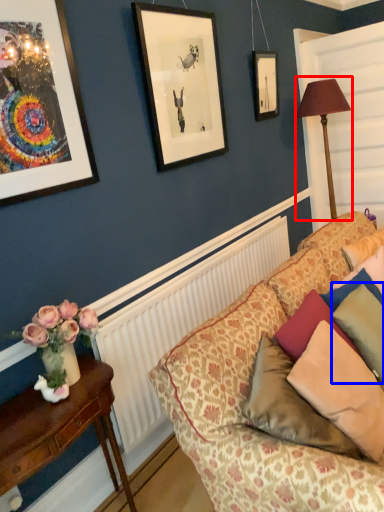
Question: Which object appears closest to the camera in this image, table lamp (highlighted by a red box) or pillow (highlighted by a blue box)?

Choices:
 (A) table lamp
 (B) pillow

Answer: (B)